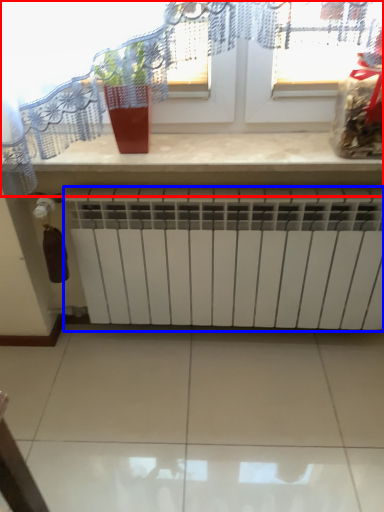
Question: Which object appears closest to the camera in this image, window (highlighted by a red box) or radiator (highlighted by a blue box)?

Choices:
 (A) window
 (B) radiator

Answer: (A)